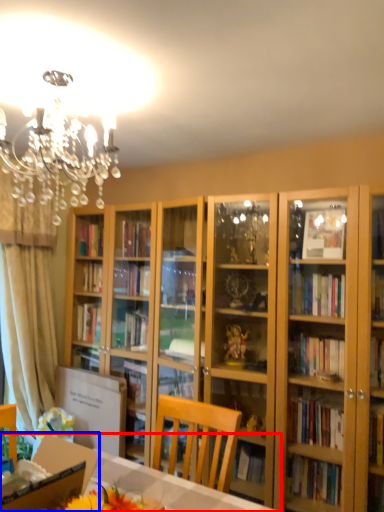
Question: Among these objects, which one is farthest to the camera, desk (highlighted by a red box) or cardboard box (highlighted by a blue box)?

Choices:
 (A) desk
 (B) cardboard box

Answer: (B)